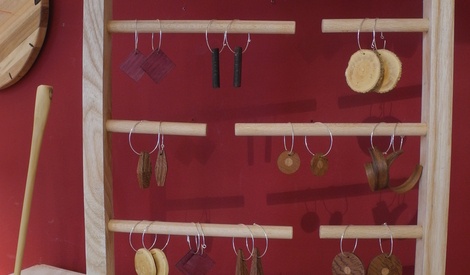
Image resolution: width=470 pixels, height=275 pixels. Find the location of `wooden handle`. wooden handle is located at coordinates (42, 122).